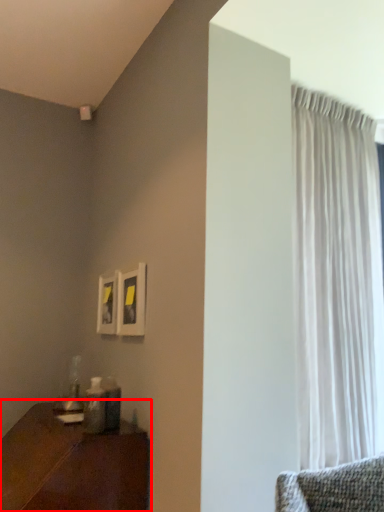
Question: From the image's perspective, where is table (annotated by the red box) located relative to curtain?

Choices:
 (A) above
 (B) below

Answer: (B)